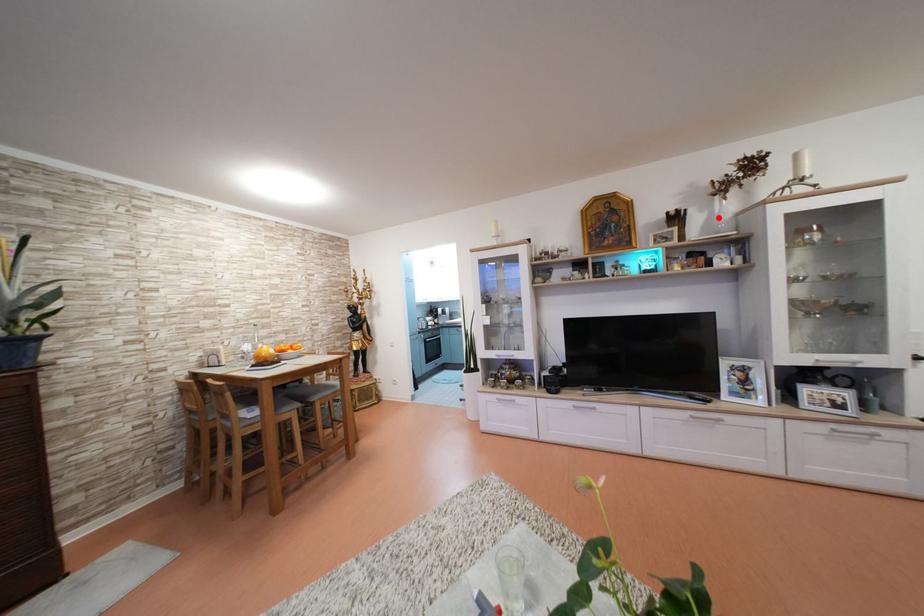
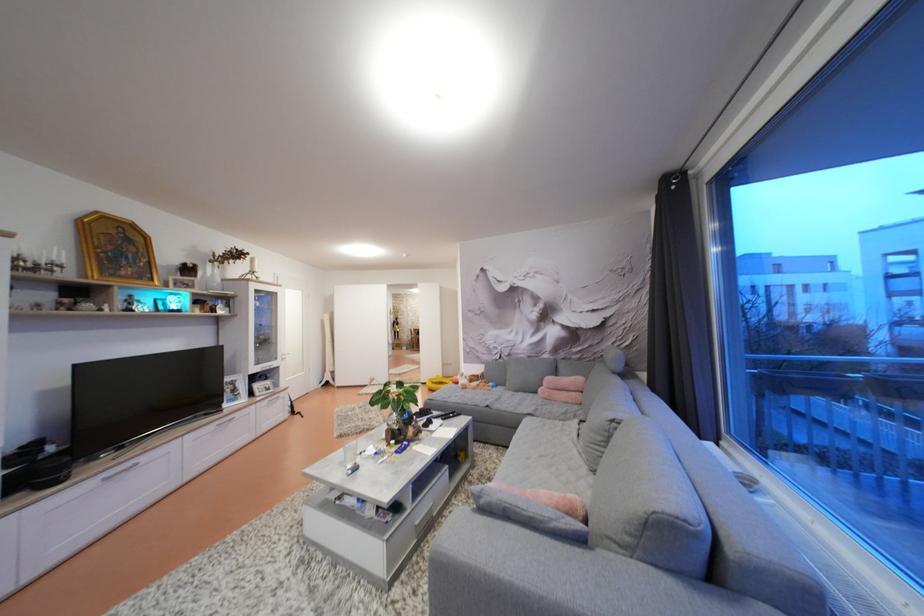
Question: I am providing you with two images of the same scene from different viewpoints. A red point is marked on the first image. At the location where the point appears in image 1, is it still visible in image 2?

Choices:
 (A) Yes
 (B) No

Answer: (A)